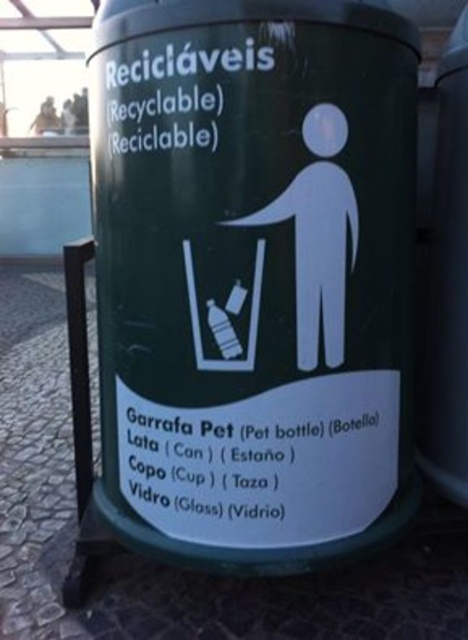
Is green matte recycling bin at center positioned in front of green matte plastic recycling bin at center?

Yes, green matte recycling bin at center is closer to the viewer.

Which is in front, point (247, 492) or point (455, 90)?

Point (247, 492) is in front.

Is point (144, 540) behind point (451, 397)?

No, (144, 540) is closer to viewer.

Identify the location of green matte recycling bin at center. (254, 275).